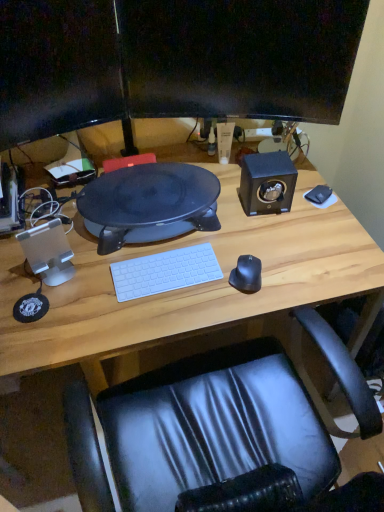
I want to click on unoccupied region to the right of white matte keyboard at center, so click(233, 270).